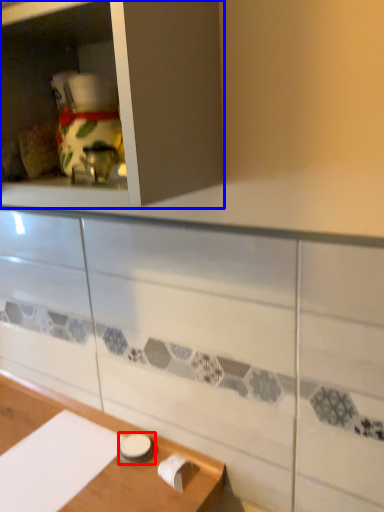
Question: Which object appears farthest to the camera in this image, tableware (highlighted by a red box) or cabinetry (highlighted by a blue box)?

Choices:
 (A) tableware
 (B) cabinetry

Answer: (A)